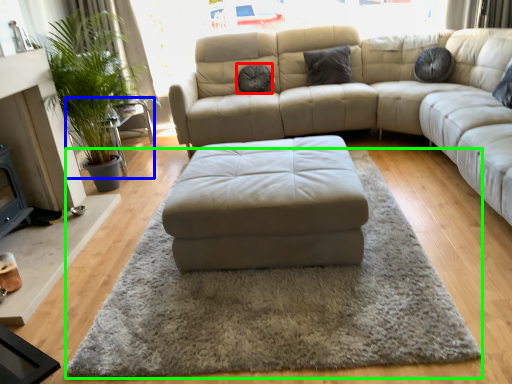
Question: Considering the real-world distances, which object is farthest from pillow (highlighted by a red box)? side table (highlighted by a blue box) or mat (highlighted by a green box)?

Choices:
 (A) side table
 (B) mat

Answer: (B)